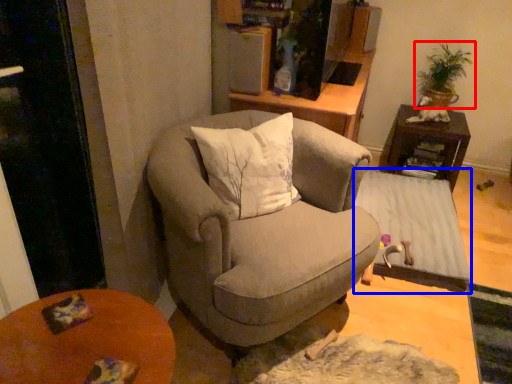
Question: Which point is further to the camera, houseplant (highlighted by a red box) or table (highlighted by a blue box)?

Choices:
 (A) houseplant
 (B) table

Answer: (A)